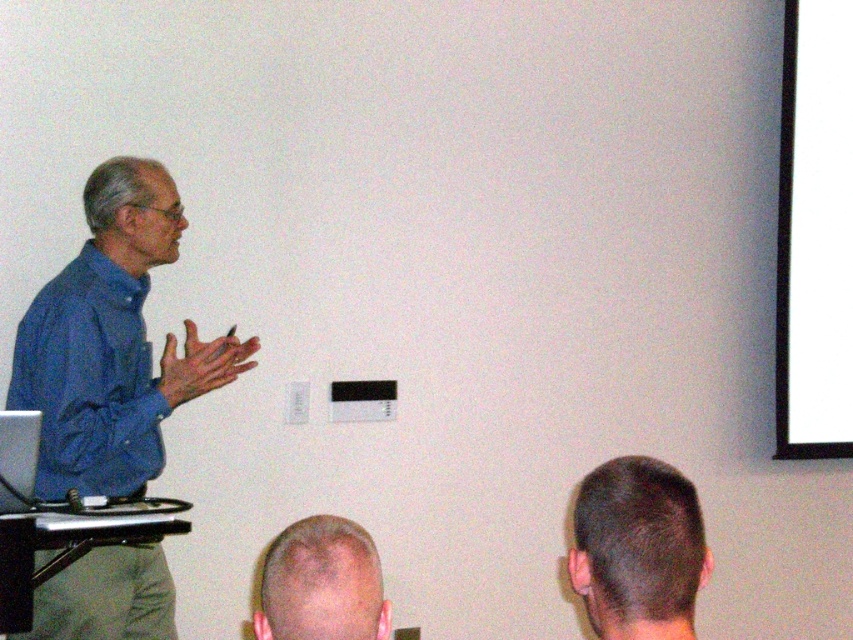
Question: Does white matte projection screen at upper right have a lesser width compared to dark brown hair at lower right?

Choices:
 (A) yes
 (B) no

Answer: (B)

Question: Does blue cotton shirt at left have a greater width compared to dark brown hair at lower right?

Choices:
 (A) no
 (B) yes

Answer: (B)

Question: Which point is farther to the camera?

Choices:
 (A) (631, 600)
 (B) (161, 168)
 (C) (776, 308)
 (D) (289, 577)

Answer: (C)

Question: Which point is farther from the camera taking this photo?

Choices:
 (A) (44, 456)
 (B) (576, 588)
 (C) (378, 557)
 (D) (790, 228)

Answer: (D)

Question: Which is farther from the light brown hair at lower center?

Choices:
 (A) blue cotton shirt at left
 (B) dark brown hair at lower right

Answer: (A)

Question: Observing the image, what is the correct spatial positioning of white matte projection screen at upper right in reference to light brown hair at lower center?

Choices:
 (A) right
 (B) left

Answer: (A)